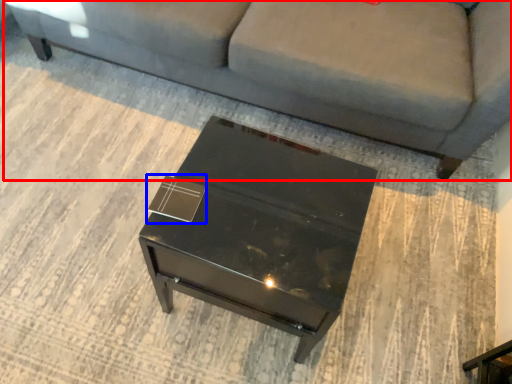
Question: Which object appears farthest to the camera in this image, studio couch (highlighted by a red box) or square (highlighted by a blue box)?

Choices:
 (A) studio couch
 (B) square

Answer: (A)